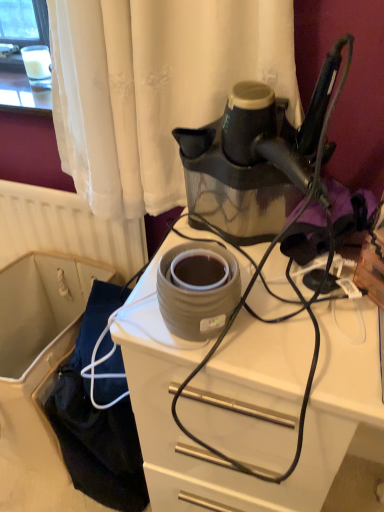
Where is `vacant area that is in front of black rubber cord at center`? The width and height of the screenshot is (384, 512). vacant area that is in front of black rubber cord at center is located at coordinates (286, 339).